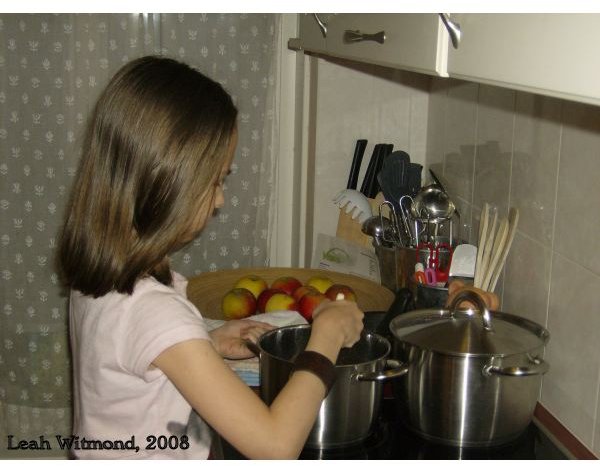
Identify the location of tile. This screenshot has height=466, width=600. (571, 317).